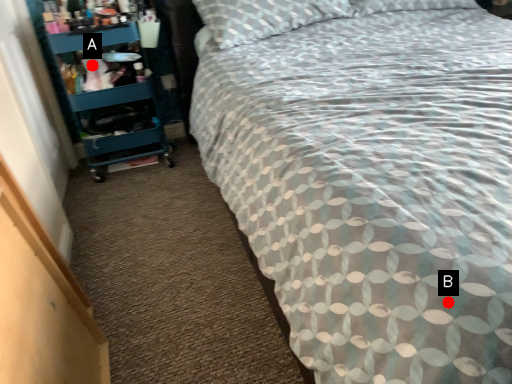
Question: Two points are circled on the image, labeled by A and B beside each circle. Which point is closer to the camera taking this photo?

Choices:
 (A) A is closer
 (B) B is closer

Answer: (B)